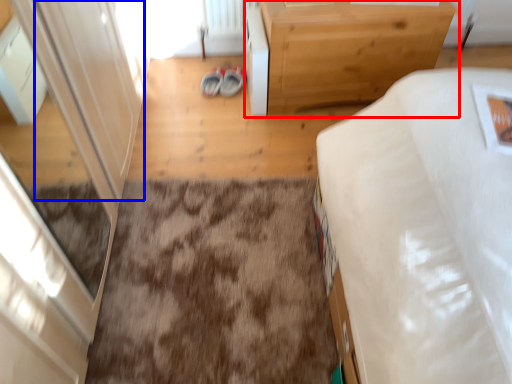
Question: Among these objects, which one is farthest to the camera, table (highlighted by a red box) or screen door (highlighted by a blue box)?

Choices:
 (A) table
 (B) screen door

Answer: (A)